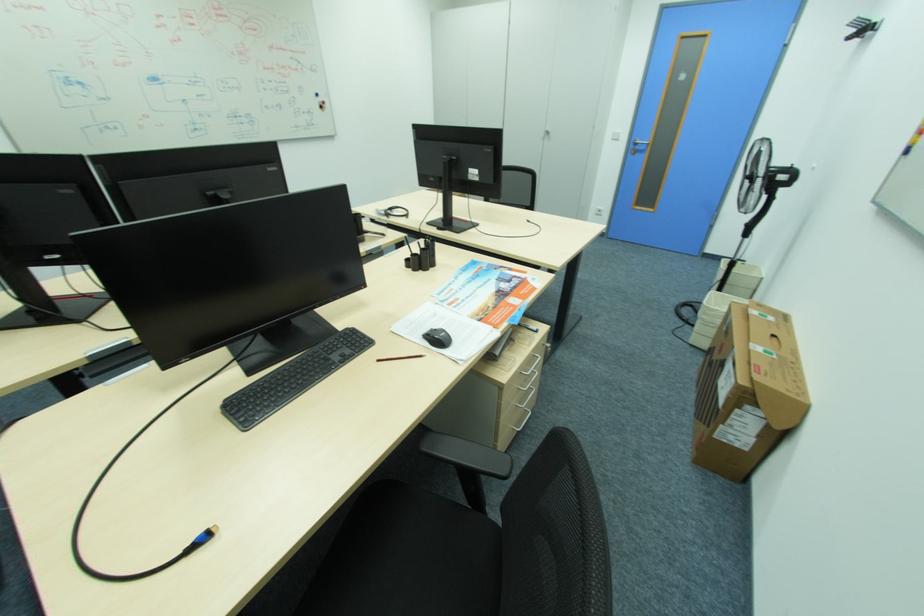
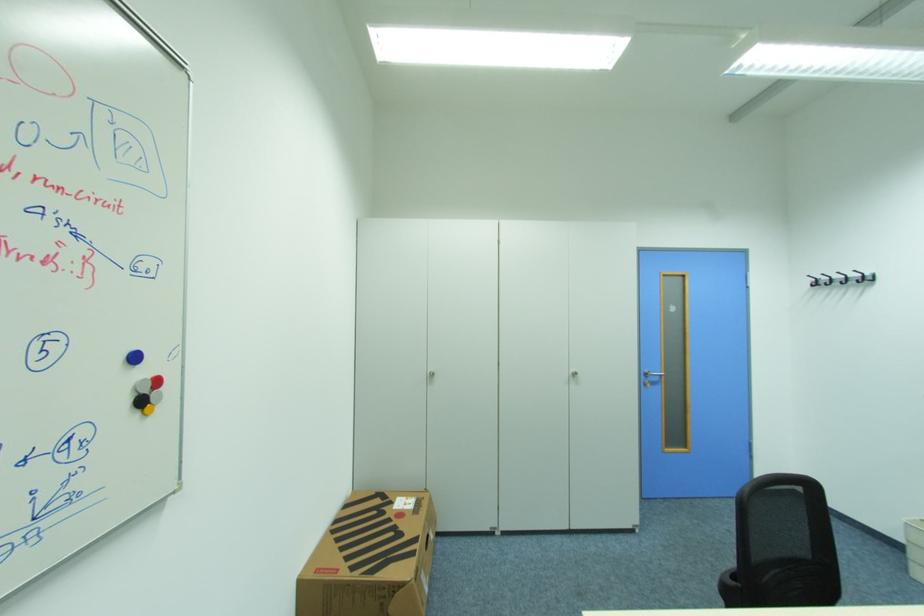
The point at (323,97) is marked in the first image. Where is the corresponding point in the second image?

(140, 359)